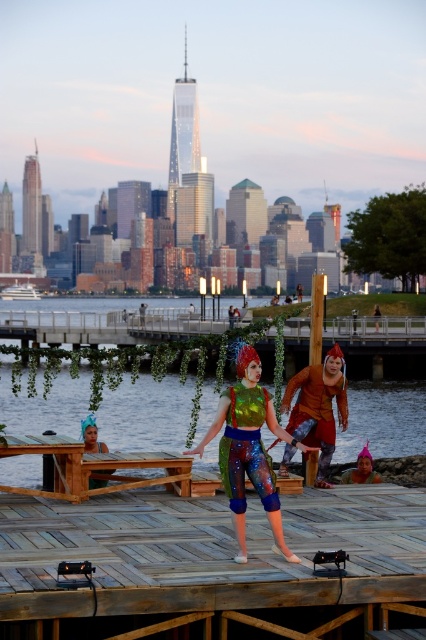
This screenshot has width=426, height=640. Find the location of `wooden dock at center`. wooden dock at center is located at coordinates (207, 563).

Does wooden dock at center have a lesser height compared to orange fabric costume at right?

Correct, wooden dock at center is not as tall as orange fabric costume at right.

What do you see at coordinates (207, 563) in the screenshot?
I see `wooden dock at center` at bounding box center [207, 563].

This screenshot has width=426, height=640. What are the coordinates of `wooden dock at center` in the screenshot? It's located at (207, 563).

Does matte pink swim cap at lower right lie behind metallic silver helmet at center?

No, it is in front of metallic silver helmet at center.

Between matte pink swim cap at lower right and metallic silver helmet at center, which one appears on the left side from the viewer's perspective?

metallic silver helmet at center

Is point (365, 451) farther from viewer compared to point (146, 307)?

No, it is not.

I want to click on matte pink swim cap at lower right, so click(362, 468).

Which is behind, point (374, 424) or point (374, 314)?

Positioned behind is point (374, 314).

Does transparent plastic water at center have a lesser width compared to shiny orange costume at center?

Incorrect, transparent plastic water at center's width is not less than shiny orange costume at center's.

Does point (370, 413) lie behind point (374, 314)?

No, it is not.

The width and height of the screenshot is (426, 640). I want to click on transparent plastic water at center, so click(385, 426).